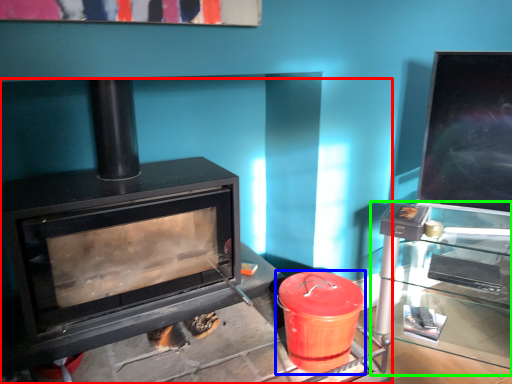
Question: Which is farther away from wood burning stove (highlighted by a red box)? crock pot (highlighted by a blue box) or table (highlighted by a green box)?

Choices:
 (A) crock pot
 (B) table

Answer: (B)